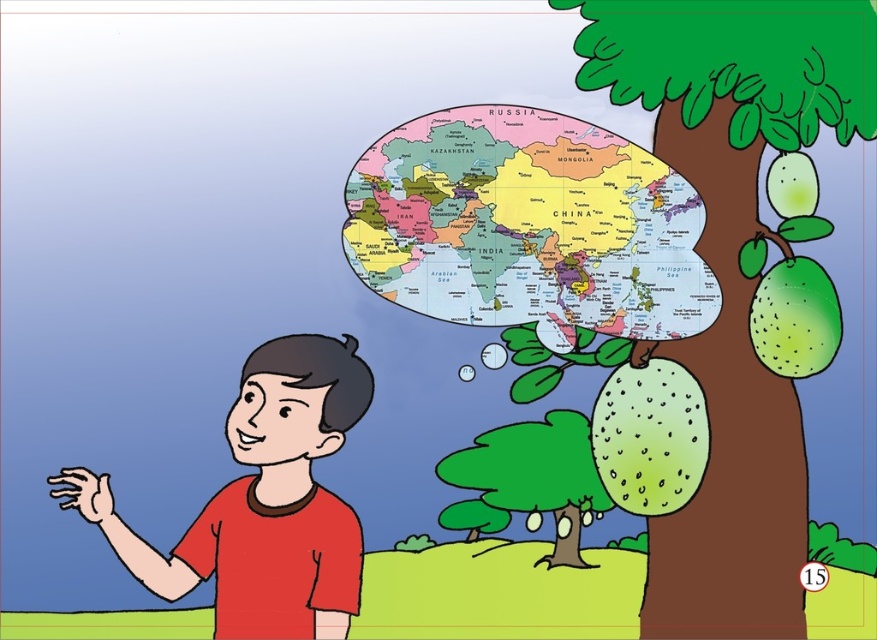
Question: Is colorful paper map at upper center thinner than green matte tree at center?

Choices:
 (A) no
 (B) yes

Answer: (A)

Question: Which of the following is the closest to the observer?

Choices:
 (A) green leafy tree at upper right
 (B) matte red shirt at left

Answer: (B)

Question: Which of these objects is positioned farthest from the green matte tree at center?

Choices:
 (A) matte red shirt at left
 (B) colorful paper map at upper center
 (C) green leafy tree at upper right

Answer: (B)

Question: Which point is farther to the camera?

Choices:
 (A) (482, 173)
 (B) (512, 465)
 (C) (250, 579)
 (D) (686, 109)

Answer: (A)

Question: Is green leafy tree at upper right to the left of matte red shirt at left from the viewer's perspective?

Choices:
 (A) yes
 (B) no

Answer: (B)

Question: Is green leafy tree at upper right to the right of matte red shirt at left from the viewer's perspective?

Choices:
 (A) yes
 (B) no

Answer: (A)